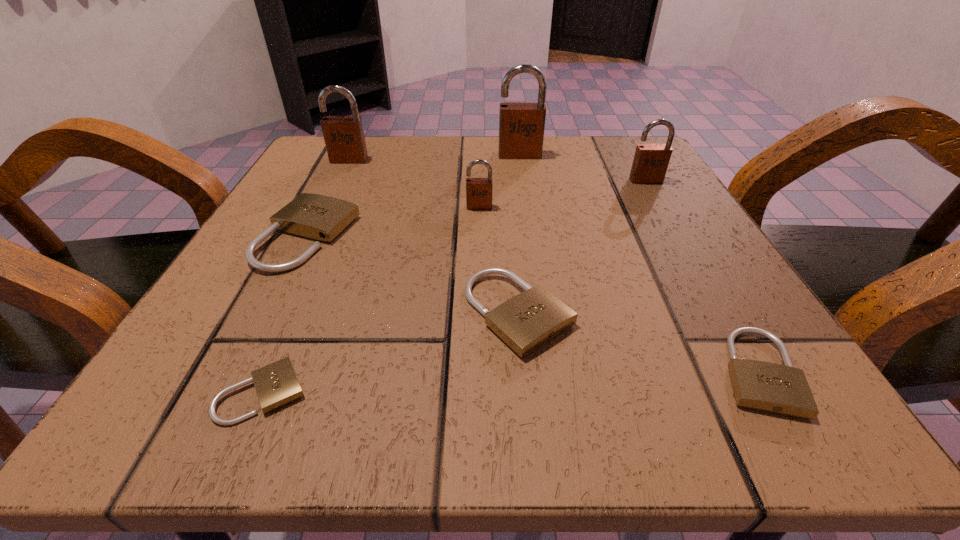
Find the location of a particular element. Image resolution: width=960 pixels, height=540 pixels. vacant point located between the sixth tallest padlock and the smallest beige padlock is located at coordinates (391, 353).

The height and width of the screenshot is (540, 960). Identify the location of unoccupied position between the sixth nearest object and the nearest brown padlock. (563, 194).

Find the location of a particular element. This screenshot has height=540, width=960. vacant region between the third beige padlock from left to right and the seventh shortest padlock is located at coordinates (434, 237).

Identify the location of object that is the second closest to the third shortest object. The height and width of the screenshot is (540, 960). (276, 384).

Locate an element on the screen. The width and height of the screenshot is (960, 540). object that is the fifth closest to the smallest beige padlock is located at coordinates (344, 138).

Select which padlock appears as the third closest to the fifth tallest padlock. Please provide its 2D coordinates. Your answer should be formatted as a tuple, i.e. [(x, y)], where the tuple contains the x and y coordinates of a point satisfying the conditions above.

[(479, 191)]

Identify which padlock is the fourth nearest to the fourth shortest object. Please provide its 2D coordinates. Your answer should be formatted as a tuple, i.e. [(x, y)], where the tuple contains the x and y coordinates of a point satisfying the conditions above.

[(526, 322)]

Identify which brown padlock is located as the second nearest to the fifth tallest padlock. Please provide its 2D coordinates. Your answer should be formatted as a tuple, i.e. [(x, y)], where the tuple contains the x and y coordinates of a point satisfying the conditions above.

[(479, 191)]

This screenshot has width=960, height=540. In order to click on brown padlock object that ranks as the third closest to the fifth shortest object in this screenshot , I will do `click(650, 163)`.

Locate an element on the screen. The width and height of the screenshot is (960, 540). the second closest beige padlock to the second tallest padlock is located at coordinates (526, 322).